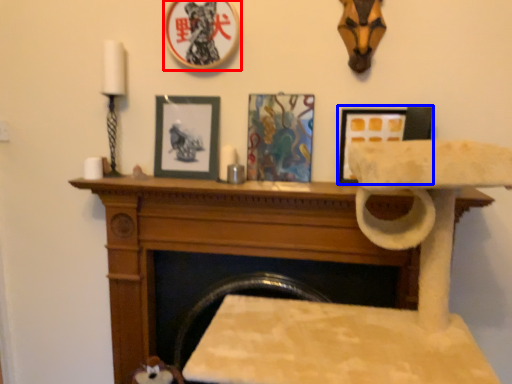
Question: Which point is further to the camera, picture frame (highlighted by a red box) or picture frame (highlighted by a blue box)?

Choices:
 (A) picture frame
 (B) picture frame

Answer: (B)